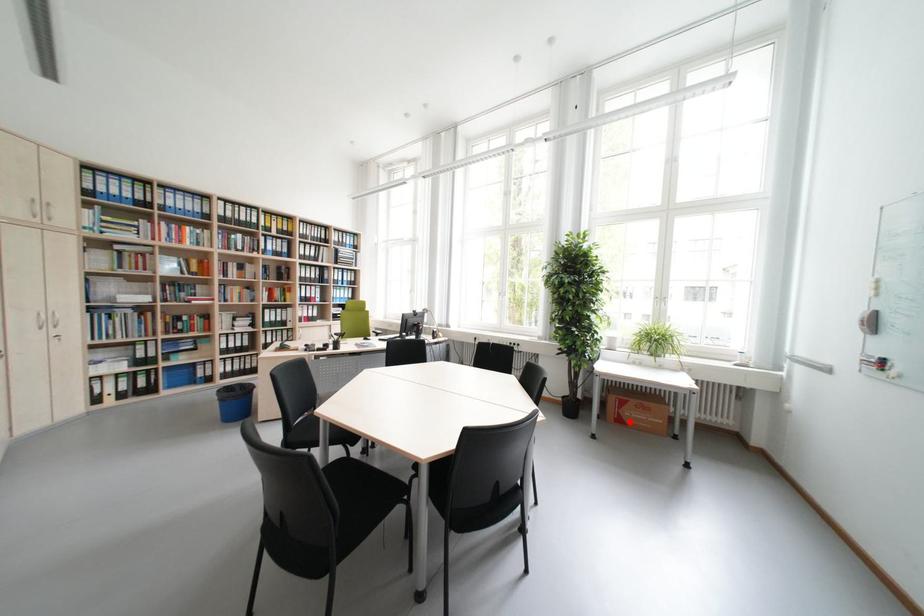
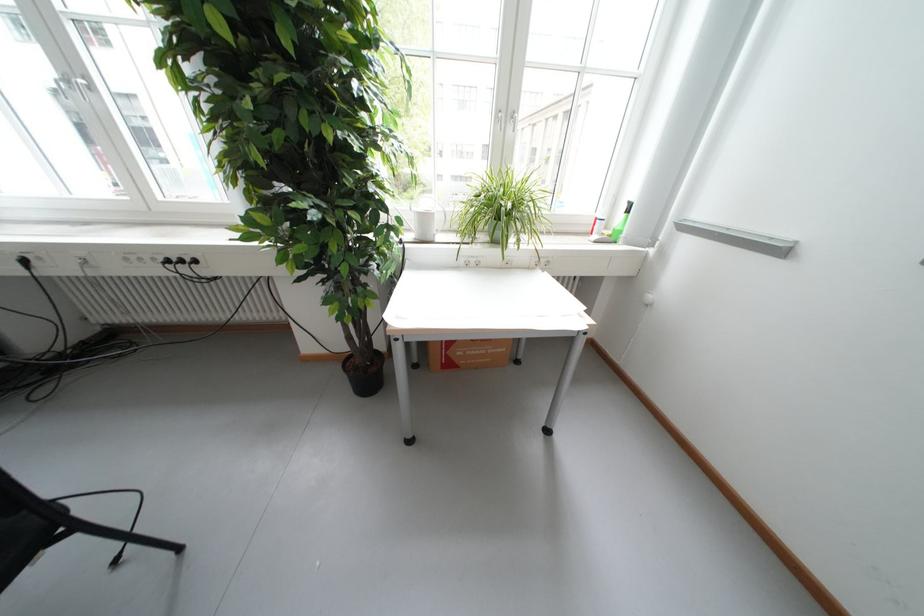
Find the pixel in the second image that matches the highlighted location in the first image.

(458, 366)